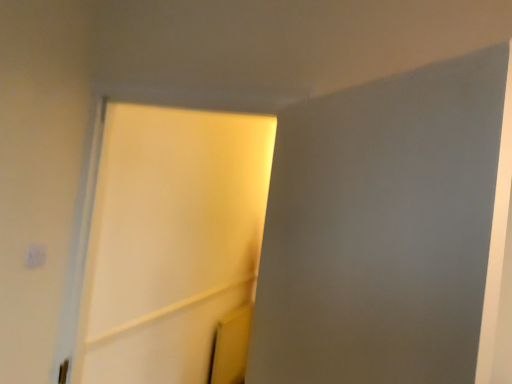
Question: In which direction should I rotate to look at white matte screen door at upper center, the first screen door when ordered from front to back?

Choices:
 (A) right
 (B) left

Answer: (A)

Question: Does white matte screen door at center, which is the first screen door in left-to-right order, have a greater height compared to white matte screen door at upper center, positioned as the 2th screen door in back-to-front order?

Choices:
 (A) yes
 (B) no

Answer: (A)

Question: Could you tell me if white matte screen door at center, which is the first screen door in back-to-front order, is facing white matte screen door at upper center, the 2th screen door positioned from the left?

Choices:
 (A) no
 (B) yes

Answer: (A)

Question: Does white matte screen door at center, marked as the 2th screen door in a right-to-left arrangement, have a greater width compared to white matte screen door at upper center, placed as the first screen door when sorted from right to left?

Choices:
 (A) no
 (B) yes

Answer: (B)

Question: Does white matte screen door at center, which is the first screen door in back-to-front order, have a larger size compared to white matte screen door at upper center, the first screen door when ordered from front to back?

Choices:
 (A) no
 (B) yes

Answer: (B)

Question: Is white matte screen door at center, which is the first screen door in left-to-right order, smaller than white matte screen door at upper center, the 2th screen door positioned from the left?

Choices:
 (A) no
 (B) yes

Answer: (A)

Question: From a real-world perspective, is white matte screen door at center, which is the first screen door in left-to-right order, positioned under white matte screen door at upper center, the first screen door when ordered from front to back, based on gravity?

Choices:
 (A) yes
 (B) no

Answer: (A)

Question: Can white matte screen door at center, which is the first screen door in left-to-right order, be found inside white matte light switch at upper left?

Choices:
 (A) no
 (B) yes

Answer: (A)

Question: Does white matte light switch at upper left turn towards white matte screen door at center, marked as the 2th screen door in a right-to-left arrangement?

Choices:
 (A) yes
 (B) no

Answer: (B)

Question: Can you confirm if white matte light switch at upper left is bigger than white matte screen door at center, which is the first screen door in left-to-right order?

Choices:
 (A) yes
 (B) no

Answer: (B)

Question: From a real-world perspective, is white matte light switch at upper left located higher than white matte screen door at center, which is the first screen door in left-to-right order?

Choices:
 (A) yes
 (B) no

Answer: (B)

Question: Considering the relative positions of white matte light switch at upper left and white matte screen door at center, marked as the 2th screen door in a right-to-left arrangement, in the image provided, is white matte light switch at upper left behind white matte screen door at center, marked as the 2th screen door in a right-to-left arrangement,?

Choices:
 (A) yes
 (B) no

Answer: (A)

Question: Considering the relative sizes of white matte light switch at upper left and white matte screen door at center, which is the first screen door in back-to-front order, in the image provided, is white matte light switch at upper left taller than white matte screen door at center, which is the first screen door in back-to-front order,?

Choices:
 (A) yes
 (B) no

Answer: (B)

Question: Can you confirm if white matte light switch at upper left is positioned to the right of white matte screen door at upper center, placed as the first screen door when sorted from right to left?

Choices:
 (A) yes
 (B) no

Answer: (B)